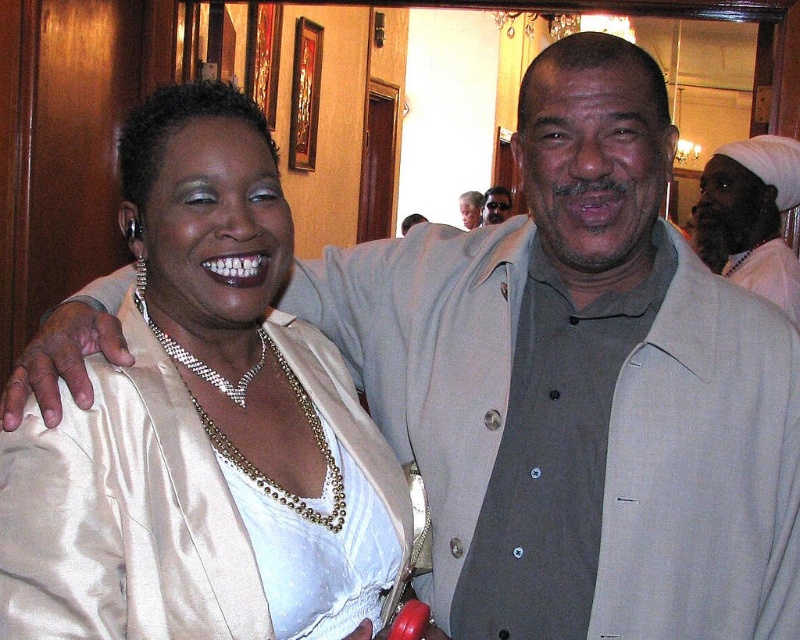
Please look at the image and locate the point at coordinates [204,422]. What object in the scene does this point correspond to?

The point at coordinates [204,422] corresponds to the satin white blouse at center.

You are a photographer trying to frame a shot of the satin white blouse at center and the beige satin jacket at upper center. Which object has a greater width?

The satin white blouse at center has a greater width than the beige satin jacket at upper center.